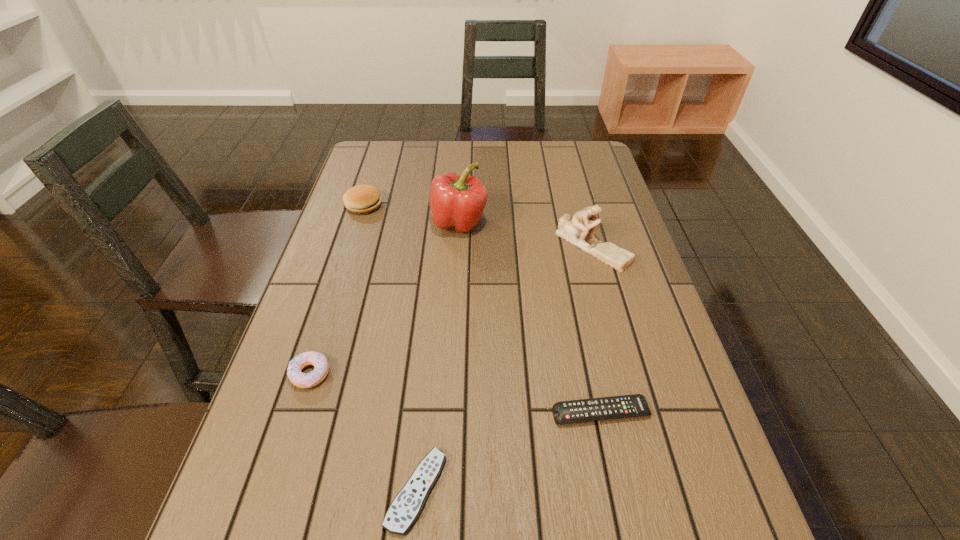
Identify the location of vacant space located 0.160m on the front-facing side of the fifth shortest object. (612, 321).

Locate an element on the screen. free region located on the back of the third tallest object is located at coordinates (377, 163).

The height and width of the screenshot is (540, 960). I want to click on free space located on the front of the fourth farthest object, so click(293, 429).

Locate an element on the screen. This screenshot has height=540, width=960. vacant area situated on the left of the fifth farthest object is located at coordinates (506, 413).

The height and width of the screenshot is (540, 960). What are the coordinates of `vacant region located 0.240m on the right of the nearer remote control` in the screenshot? It's located at (586, 490).

At what (x,y) coordinates should I click in order to perform the action: click on patty at the left edge. Please return your answer as a coordinate pair (x, y). The width and height of the screenshot is (960, 540). Looking at the image, I should click on (361, 199).

Where is `doughnut located at the left edge`? The width and height of the screenshot is (960, 540). doughnut located at the left edge is located at coordinates pos(302,380).

Locate an element on the screen. The image size is (960, 540). figurine located at the right edge is located at coordinates (575, 230).

You are a GUI agent. You are given a task and a screenshot of the screen. Output one action in this format:
    pyautogui.click(x=<x>, y=<y>)
    Task: Click on the remote control positioned at the right edge
    
    Given the screenshot: What is the action you would take?
    pyautogui.click(x=574, y=411)

Locate an element on the screen. The image size is (960, 540). vacant space at the far edge is located at coordinates (441, 155).